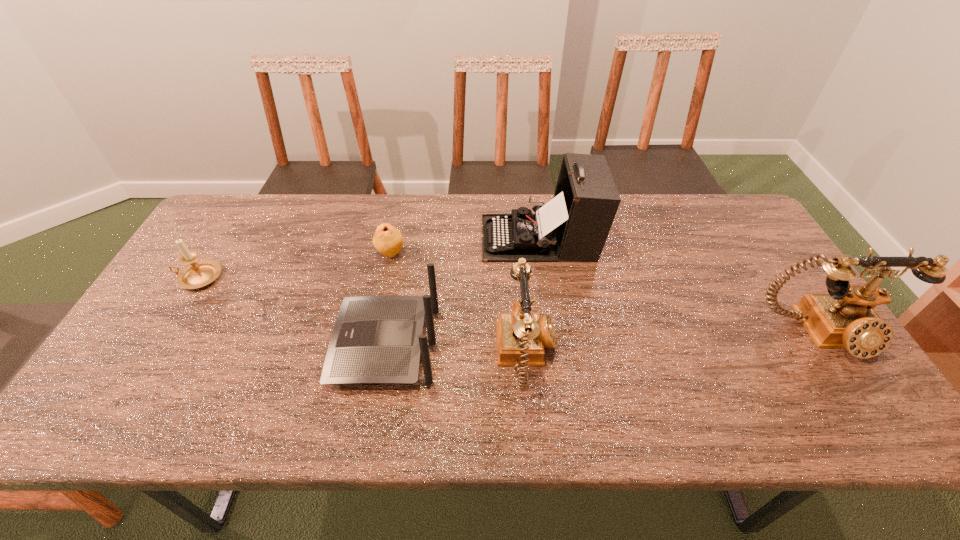
Locate an element on the screen. The width and height of the screenshot is (960, 540). vacant space positioned inside the open case of the typewriter is located at coordinates (379, 238).

The image size is (960, 540). Find the location of `free space located 0.180m inside the open case of the typewriter`. free space located 0.180m inside the open case of the typewriter is located at coordinates (423, 238).

Locate an element on the screen. The image size is (960, 540). vacant space situated 0.190m on the front of the pear is located at coordinates (378, 314).

The image size is (960, 540). What are the coordinates of `free space located 0.260m on the front-facing side of the router` in the screenshot? It's located at (230, 345).

This screenshot has height=540, width=960. I want to click on vacant area located 0.270m on the front-facing side of the router, so click(x=227, y=345).

At what (x,y) coordinates should I click in order to perform the action: click on vacant area situated 0.170m on the front-facing side of the router. Please return your answer as a coordinate pair (x, y). The image size is (960, 540). Looking at the image, I should click on (267, 345).

Find the location of a particular element. object at the far edge is located at coordinates (574, 225).

Where is `router located at the near edge`? The height and width of the screenshot is (540, 960). router located at the near edge is located at coordinates (376, 339).

Identify the location of object situated at the left edge. This screenshot has height=540, width=960. (201, 273).

Where is `object that is at the right edge`? object that is at the right edge is located at coordinates (845, 318).